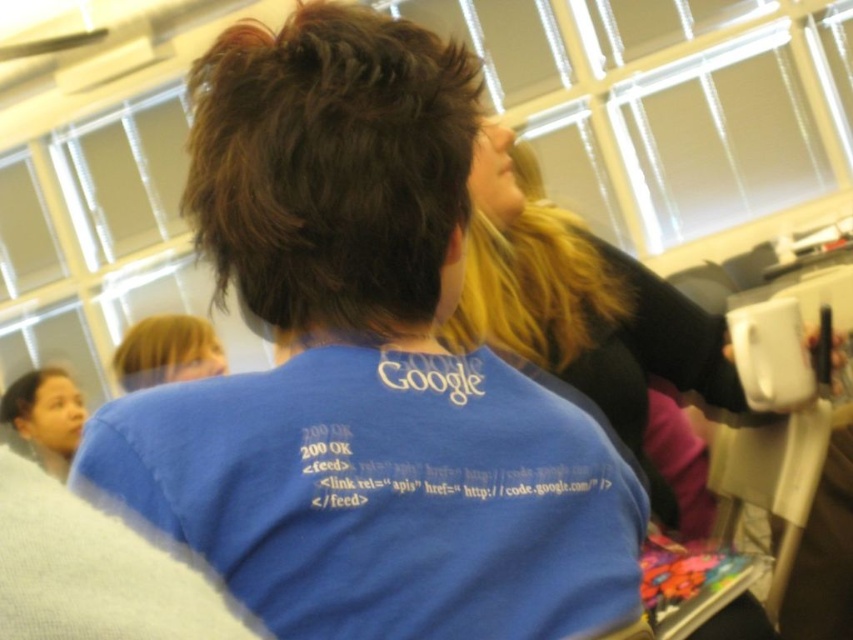
You are a photographer at the event and need to capture a photo that includes both the dark brown textured hair at center and the brown matte hair at upper left. Considering their heights, which person should you position closer to the camera to ensure both are fully visible in the frame?

The dark brown textured hair at center is much taller than the brown matte hair at upper left. To ensure both are fully visible, position the brown matte hair at upper left closer to the camera so their height difference balances in the photo.

You are standing at the point with coordinates point (x=26, y=406) and want to move to the exit door located at point (x=448, y=108). Can you walk directly towards the exit without any obstacles between you and the exit?

Yes, you can walk directly towards the exit because point (x=448, y=108) is in front of point (x=26, y=406), meaning there are no obstacles blocking the path between them.